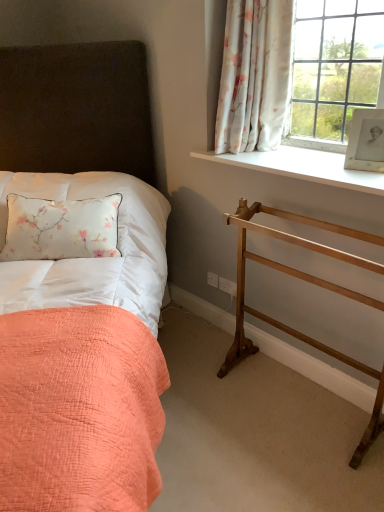
Measure the distance between white smooth window sill at upper right and camera.

white smooth window sill at upper right is 1.56 meters from camera.

Where is `wooden balustrade at right`? This screenshot has width=384, height=512. wooden balustrade at right is located at coordinates (309, 282).

The image size is (384, 512). Describe the element at coordinates (309, 282) in the screenshot. I see `wooden balustrade at right` at that location.

The image size is (384, 512). I want to click on matte fabric bed at left, so click(x=80, y=283).

This screenshot has height=512, width=384. Find the location of `floral fabric curtain at upper right`. floral fabric curtain at upper right is located at coordinates (254, 75).

Locate an element on the screen. The height and width of the screenshot is (512, 384). white smooth window sill at upper right is located at coordinates (302, 167).

Is matte fabric bed at left inside or outside of floral fabric curtain at upper right?

matte fabric bed at left exists outside the volume of floral fabric curtain at upper right.

Find the location of a particular element. Image resolution: width=384 pixels, height=512 pixels. bed that is in front of the floral fabric curtain at upper right is located at coordinates (80, 283).

Which is closer, (x=46, y=485) or (x=274, y=83)?

Clearly, point (x=46, y=485) is closer to the camera than point (x=274, y=83).

Based on the photo, is matte fabric bed at left in front of floral fabric curtain at upper right?

Yes.

Relative to wooden balustrade at right, is matte fabric bed at left in front or behind?

Clearly, matte fabric bed at left is in front of wooden balustrade at right.

Is matte fabric bed at left next to wooden balustrade at right and touching it?

No, matte fabric bed at left is not with wooden balustrade at right.

Is matte fabric bed at left wider or thinner than wooden balustrade at right?

Result: matte fabric bed at left is wider than wooden balustrade at right.

Is matte fabric bed at left completely or partially outside of wooden balustrade at right?

Yes, matte fabric bed at left is outside of wooden balustrade at right.

Considering their positions, is white paper photo frame at upper right located in front of or behind white quilted fabric at upper left?

white paper photo frame at upper right is positioned closer to the viewer than white quilted fabric at upper left.

Does white paper photo frame at upper right appear on the right side of white quilted fabric at upper left?

Yes.

Is floral fabric curtain at upper right turned away from wooden balustrade at right?

floral fabric curtain at upper right does not have its back to wooden balustrade at right.

Does floral fabric curtain at upper right have a smaller size compared to wooden balustrade at right?

Correct, floral fabric curtain at upper right occupies less space than wooden balustrade at right.

The image size is (384, 512). What are the coordinates of `curtain on the left of the wooden balustrade at right` in the screenshot? It's located at (254, 75).

Is floral fabric curtain at upper right in front of or behind wooden balustrade at right in the image?

Clearly, floral fabric curtain at upper right is behind wooden balustrade at right.

Is there a large distance between wooden balustrade at right and matte fabric bed at left?

No, there isn't a large distance between wooden balustrade at right and matte fabric bed at left.

Considering the sizes of objects wooden balustrade at right and matte fabric bed at left in the image provided, who is thinner, wooden balustrade at right or matte fabric bed at left?

wooden balustrade at right.

From the image's perspective, which one is positioned higher, wooden balustrade at right or matte fabric bed at left?

From the image's view, matte fabric bed at left is above.

Who is bigger, white quilted fabric at upper left or matte fabric bed at left?

matte fabric bed at left is bigger.

From the image's perspective, is white quilted fabric at upper left positioned above or below matte fabric bed at left?

white quilted fabric at upper left is above matte fabric bed at left.

Based on the photo, is white quilted fabric at upper left thinner than matte fabric bed at left?

Indeed, white quilted fabric at upper left has a lesser width compared to matte fabric bed at left.

Does white quilted fabric at upper left appear on the right side of matte fabric bed at left?

Yes, white quilted fabric at upper left is to the right of matte fabric bed at left.

Locate an element on the screen. This screenshot has height=512, width=384. window sill on the right of white quilted fabric at upper left is located at coordinates (302, 167).

Is white smooth window sill at upper right taller than white quilted fabric at upper left?

In fact, white smooth window sill at upper right may be shorter than white quilted fabric at upper left.

Looking at their sizes, would you say white smooth window sill at upper right is wider or thinner than white quilted fabric at upper left?

In the image, white smooth window sill at upper right appears to be more narrow than white quilted fabric at upper left.

Find the location of `curtain above the matte fabric bed at left (from a real-world perspective)`. curtain above the matte fabric bed at left (from a real-world perspective) is located at coordinates (254, 75).

In order to click on bed that is above the wooden balustrade at right (from the image's perspective) in this screenshot , I will do `click(80, 283)`.

When comparing their distances from white paper photo frame at upper right, does wooden balustrade at right or floral fabric curtain at upper right seem closer?

wooden balustrade at right lies closer to white paper photo frame at upper right than the other object.

When comparing their distances from white smooth window sill at upper right, does wooden balustrade at right or matte fabric bed at left seem further?

The object further to white smooth window sill at upper right is matte fabric bed at left.

Based on their spatial positions, is floral fabric curtain at upper right or white quilted fabric at upper left further from white paper photo frame at upper right?

white quilted fabric at upper left.

From the image, which object appears to be farther from white paper photo frame at upper right, white smooth window sill at upper right or white quilted fabric at upper left?

white quilted fabric at upper left.

Based on their spatial positions, is white smooth window sill at upper right or matte fabric bed at left closer to white paper photo frame at upper right?

white smooth window sill at upper right is closer to white paper photo frame at upper right.

Looking at the image, which one is located closer to white quilted fabric at upper left, white paper photo frame at upper right or matte fabric bed at left?

matte fabric bed at left is positioned closer to the anchor white quilted fabric at upper left.

Which object lies further to the anchor point white quilted fabric at upper left, matte fabric bed at left or wooden balustrade at right?

wooden balustrade at right lies further to white quilted fabric at upper left than the other object.

When comparing their distances from white paper photo frame at upper right, does white quilted fabric at upper left or matte fabric bed at left seem closer?

white quilted fabric at upper left is positioned closer to the anchor white paper photo frame at upper right.

Identify the location of window sill situated between matte fabric bed at left and white paper photo frame at upper right from left to right. (302, 167).

I want to click on curtain located between matte fabric bed at left and wooden balustrade at right in the left-right direction, so click(x=254, y=75).

This screenshot has width=384, height=512. Identify the location of curtain between white quilted fabric at upper left and wooden balustrade at right. (254, 75).

At what (x,y) coordinates should I click in order to perform the action: click on balustrade between matte fabric bed at left and white paper photo frame at upper right in the horizontal direction. Please return your answer as a coordinate pair (x, y). Looking at the image, I should click on (309, 282).